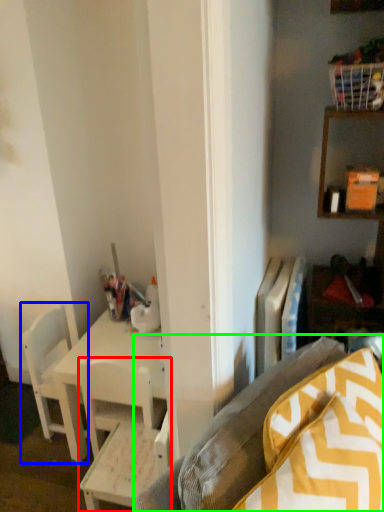
Question: Considering the real-world distances, which object is farthest from chair (highlighted by a red box)? chair (highlighted by a blue box) or studio couch (highlighted by a green box)?

Choices:
 (A) chair
 (B) studio couch

Answer: (B)